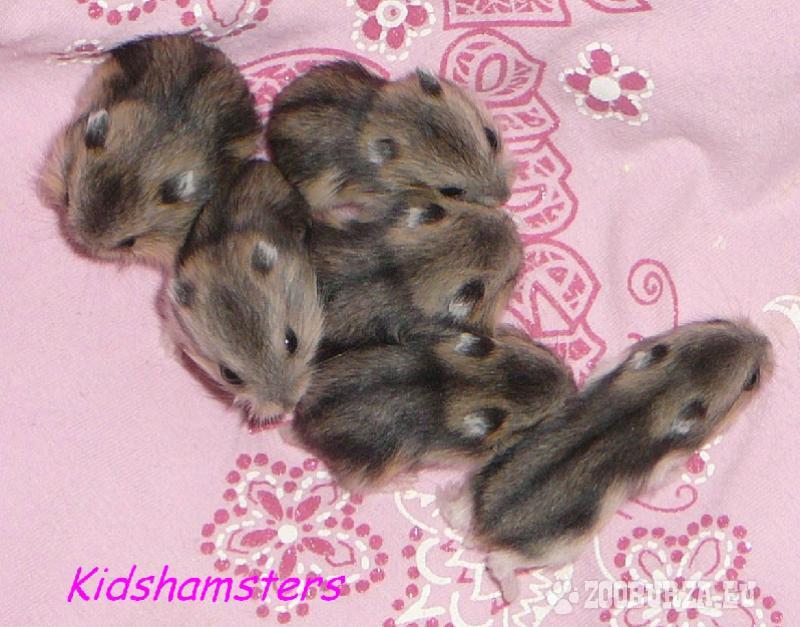
Locate an element on the screen. This screenshot has width=800, height=627. pink fabric is located at coordinates (666, 171), (72, 482).